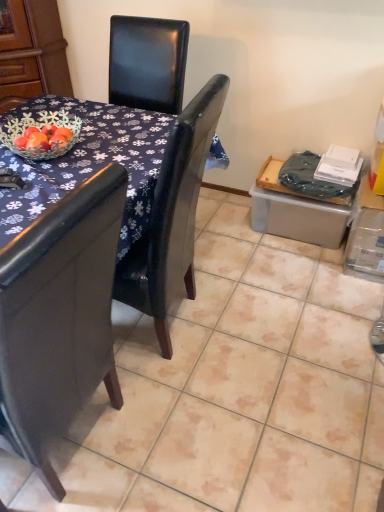
Image resolution: width=384 pixels, height=512 pixels. Describe the element at coordinates (32, 53) in the screenshot. I see `brushed wood armoire at upper left` at that location.

You are a GUI agent. You are given a task and a screenshot of the screen. Output one action in this format:
    pyautogui.click(x=<x>, y=<y>)
    Task: Click on the glossy dark wood table at center
    Image resolution: width=384 pixels, height=512 pixels.
    Given the screenshot: What is the action you would take?
    pyautogui.click(x=87, y=163)

Is black leather chair at upper center next to glossy dark wood table at center?

Yes, black leather chair at upper center is next to glossy dark wood table at center.

Which is correct: black leather chair at upper center is inside glossy dark wood table at center, or outside of it?

black leather chair at upper center fits inside glossy dark wood table at center.

From the image's perspective, is black leather chair at upper center located above glossy dark wood table at center?

Indeed, from the image's perspective, black leather chair at upper center is shown above glossy dark wood table at center.

Is black leather chair at upper center thinner than glossy dark wood table at center?

Yes.

This screenshot has width=384, height=512. What are the coordinates of `desk below the brushed wood armoire at upper left (from a real-world perspective)` in the screenshot? It's located at (86, 161).

Considering the positions of objects black leather chair at upper center and brushed wood armoire at upper left in the image provided, who is in front, black leather chair at upper center or brushed wood armoire at upper left?

Positioned in front is black leather chair at upper center.

Is black leather chair at upper center turned away from brushed wood armoire at upper left?

No.

Considering the points (130, 174) and (0, 77), which point is behind, point (130, 174) or point (0, 77)?

The point (0, 77) is farther from the camera.

Considering the relative positions of glossy dark wood table at center and black leather chair at upper center in the image provided, is glossy dark wood table at center behind black leather chair at upper center?

No, glossy dark wood table at center is closer to the viewer.

Considering the positions of point (144, 178) and point (27, 214), is point (144, 178) closer or farther from the camera than point (27, 214)?

Point (144, 178).

This screenshot has width=384, height=512. I want to click on desk that appears on the right of glossy dark wood table at center, so click(86, 161).

What's the angular difference between brushed wood armoire at upper left and black leather chair at upper center's facing directions?

They differ by 47.2 degrees in their facing directions.

Considering the sizes of objects brushed wood armoire at upper left and black leather chair at upper center in the image provided, who is thinner, brushed wood armoire at upper left or black leather chair at upper center?

Thinner between the two is brushed wood armoire at upper left.

Find the location of a particular element. Image resolution: width=384 pixels, height=512 pixels. desk lying on the right of brushed wood armoire at upper left is located at coordinates (86, 161).

How different are the orientations of glossy dark wood table at center and brushed wood armoire at upper left in degrees?

The facing directions of glossy dark wood table at center and brushed wood armoire at upper left are 47.5 degrees apart.

Would you say glossy dark wood table at center contains brushed wood armoire at upper left?

Definitely not — brushed wood armoire at upper left is not inside glossy dark wood table at center.

From the image's perspective, between glossy dark wood table at center and brushed wood armoire at upper left, who is located below?

From the image's view, glossy dark wood table at center is below.

How far apart are glossy dark wood table at center and brushed wood armoire at upper left?

glossy dark wood table at center and brushed wood armoire at upper left are 95.18 centimeters apart from each other.

Based on the photo, does brushed wood armoire at upper left turn towards glossy dark wood table at center?

Yes, brushed wood armoire at upper left is aimed at glossy dark wood table at center.

Consider the image. From a real-world perspective, relative to glossy dark wood table at center, is brushed wood armoire at upper left vertically above or below?

Clearly, from a real-world perspective, brushed wood armoire at upper left is above glossy dark wood table at center.

Can you confirm if brushed wood armoire at upper left is taller than glossy dark wood table at center?

Incorrect, the height of brushed wood armoire at upper left is not larger of that of glossy dark wood table at center.

Considering the positions of points (61, 33) and (141, 200), is point (61, 33) farther from camera compared to point (141, 200)?

That is True.

Where is `table that appears below the black leather chair at upper center (from the image's perspective)`? Image resolution: width=384 pixels, height=512 pixels. table that appears below the black leather chair at upper center (from the image's perspective) is located at coordinates (87, 163).

Where is `desk on the right of brushed wood armoire at upper left`? desk on the right of brushed wood armoire at upper left is located at coordinates (86, 161).

Which object lies nearer to the anchor point brushed wood armoire at upper left, glossy dark wood table at center or black leather chair at upper center?

Among the two, glossy dark wood table at center is located nearer to brushed wood armoire at upper left.

When comparing their distances from black leather chair at upper center, does glossy dark wood table at center or brushed wood armoire at upper left seem further?

The object further to black leather chair at upper center is brushed wood armoire at upper left.

From the image, which object appears to be farther from brushed wood armoire at upper left, black leather chair at upper center or glossy dark wood table at center?

black leather chair at upper center is further to brushed wood armoire at upper left.

In the scene shown: From the image, which object appears to be nearer to glossy dark wood table at center, black leather chair at upper center or brushed wood armoire at upper left?

black leather chair at upper center is closer to glossy dark wood table at center.

Estimate the real-world distances between objects in this image. Which object is closer to glossy dark wood table at center, brushed wood armoire at upper left or black leather chair at upper center?

Based on the image, black leather chair at upper center appears to be nearer to glossy dark wood table at center.

Based on the photo, looking at the image, which one is located closer to black leather chair at upper center, brushed wood armoire at upper left or glossy dark wood table at center?

Based on the image, glossy dark wood table at center appears to be nearer to black leather chair at upper center.

This screenshot has width=384, height=512. In order to click on desk located between glossy dark wood table at center and brushed wood armoire at upper left in the depth direction in this screenshot , I will do `click(86, 161)`.